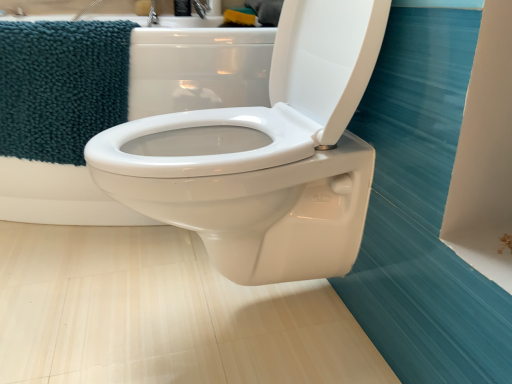
Consider the image. Measure the distance between teal plush towel at upper left and camera.

A distance of 3.63 feet exists between teal plush towel at upper left and camera.

This screenshot has width=512, height=384. What do you see at coordinates (61, 86) in the screenshot?
I see `teal plush towel at upper left` at bounding box center [61, 86].

Image resolution: width=512 pixels, height=384 pixels. What are the coordinates of `teal plush towel at upper left` in the screenshot? It's located at (61, 86).

The image size is (512, 384). What do you see at coordinates (197, 67) in the screenshot?
I see `white glossy toilet at center` at bounding box center [197, 67].

Find the location of `white glossy toilet at center`. white glossy toilet at center is located at coordinates (197, 67).

Image resolution: width=512 pixels, height=384 pixels. In order to click on teal plush towel at upper left in this screenshot , I will do [61, 86].

Considering the relative positions of teal plush towel at upper left and white glossy toilet at center in the image provided, is teal plush towel at upper left to the right of white glossy toilet at center from the viewer's perspective?

In fact, teal plush towel at upper left is to the left of white glossy toilet at center.

Considering their positions, is teal plush towel at upper left located in front of or behind white glossy toilet at center?

Visually, teal plush towel at upper left is located behind white glossy toilet at center.

Between point (1, 76) and point (202, 47), which one is positioned behind?

Point (1, 76)

From the image's perspective, is teal plush towel at upper left below white glossy toilet at center?

Yes, from the image's perspective, teal plush towel at upper left is below white glossy toilet at center.

From a real-world perspective, between teal plush towel at upper left and white glossy toilet at center, who is vertically lower?

From a 3D spatial view, white glossy toilet at center is below.

Looking at this image, is teal plush towel at upper left thinner than white glossy toilet at center?

Yes, teal plush towel at upper left is thinner than white glossy toilet at center.

Between teal plush towel at upper left and white glossy toilet at center, which one has less height?

teal plush towel at upper left.

Who is smaller, teal plush towel at upper left or white glossy toilet at center?

Smaller between the two is teal plush towel at upper left.

Would you say white glossy toilet at center is part of teal plush towel at upper left's contents?

No, white glossy toilet at center is not a part of teal plush towel at upper left.

Is there a large distance between teal plush towel at upper left and white glossy toilet at center?

No, teal plush towel at upper left is not far from white glossy toilet at center.

Does teal plush towel at upper left turn towards white glossy toilet at center?

Yes.

Consider the image. How many degrees apart are the facing directions of teal plush towel at upper left and white glossy toilet at center?

A: The angle between the facing direction of teal plush towel at upper left and the facing direction of white glossy toilet at center is 25.1 degrees.

The height and width of the screenshot is (384, 512). Find the location of `beach towel below the white glossy toilet at center (from the image's perspective)`. beach towel below the white glossy toilet at center (from the image's perspective) is located at coordinates (61, 86).

Is white glossy toilet at center at the left side of teal plush towel at upper left?

Incorrect, white glossy toilet at center is not on the left side of teal plush towel at upper left.

Between white glossy toilet at center and teal plush towel at upper left, which one is positioned in front?

white glossy toilet at center.

Does point (183, 58) come closer to viewer compared to point (94, 111)?

Yes, it is.

From the image's perspective, who appears lower, white glossy toilet at center or teal plush towel at upper left?

teal plush towel at upper left appears lower in the image.

Looking at this image, from a real-world perspective, between white glossy toilet at center and teal plush towel at upper left, who is vertically higher?

teal plush towel at upper left.

Does white glossy toilet at center have a lesser width compared to teal plush towel at upper left?

In fact, white glossy toilet at center might be wider than teal plush towel at upper left.

Considering the sizes of objects white glossy toilet at center and teal plush towel at upper left in the image provided, who is taller, white glossy toilet at center or teal plush towel at upper left?

white glossy toilet at center.

Does white glossy toilet at center have a smaller size compared to teal plush towel at upper left?

No.

Is white glossy toilet at center outside of teal plush towel at upper left?

Absolutely, white glossy toilet at center is external to teal plush towel at upper left.

Is white glossy toilet at center positioned far away from teal plush towel at upper left?

white glossy toilet at center is actually quite close to teal plush towel at upper left.

Is white glossy toilet at center turned away from teal plush towel at upper left?

No, white glossy toilet at center is not facing away from teal plush towel at upper left.

What's the angular difference between white glossy toilet at center and teal plush towel at upper left's facing directions?

25.1 degrees separate the facing orientations of white glossy toilet at center and teal plush towel at upper left.

Measure the distance from white glossy toilet at center to teal plush towel at upper left.

The distance of white glossy toilet at center from teal plush towel at upper left is 8.00 inches.

Identify the location of bath to the right of teal plush towel at upper left. The height and width of the screenshot is (384, 512). 197,67.

The image size is (512, 384). In order to click on beach towel on the left of the white glossy toilet at center in this screenshot , I will do `click(61, 86)`.

The width and height of the screenshot is (512, 384). What are the coordinates of `beach towel above the white glossy toilet at center (from a real-world perspective)` in the screenshot? It's located at (61, 86).